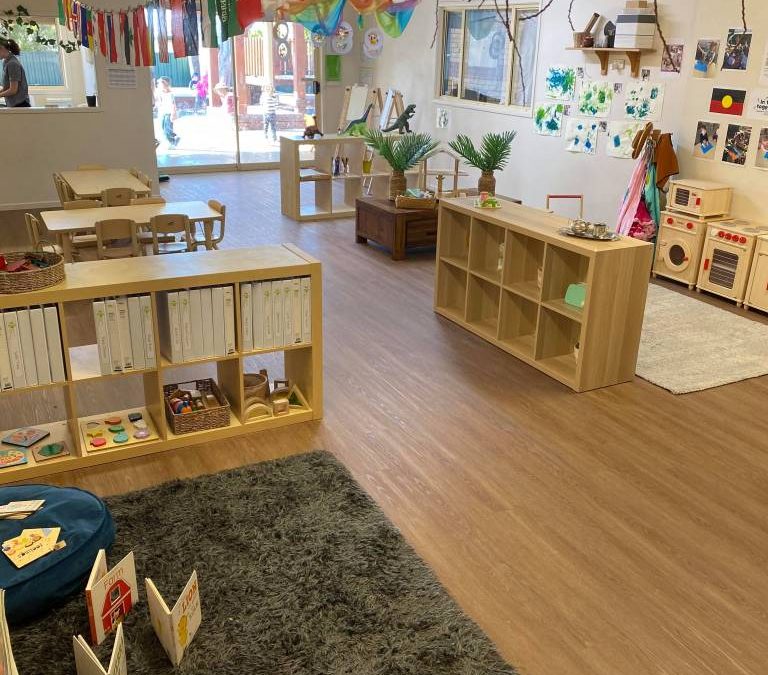
Locate an element on the screen. This screenshot has width=768, height=675. open books is located at coordinates (91, 615).